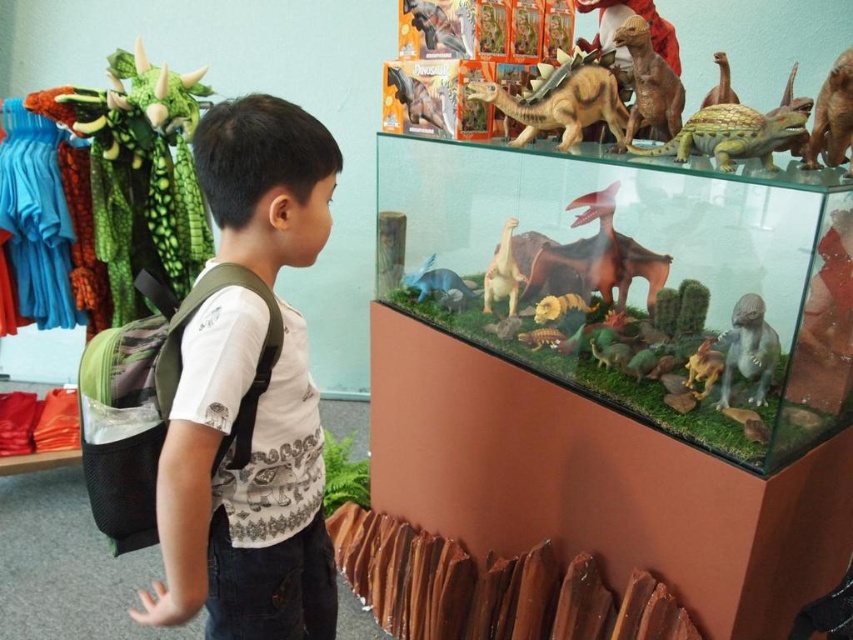
The boy is trying to decide which dinosaur model to look at first. He notices the brown plastic dinosaur at upper center and the matte brown dinosaur at center. Which one is bigger?

The brown plastic dinosaur at upper center is larger in size compared to the matte brown dinosaur at center.